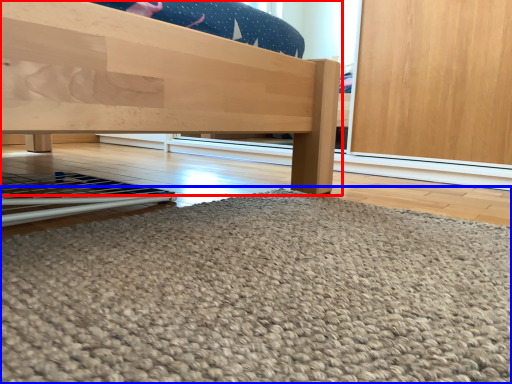
Question: Among these objects, which one is farthest to the camera, furniture (highlighted by a red box) or door (highlighted by a blue box)?

Choices:
 (A) furniture
 (B) door

Answer: (A)